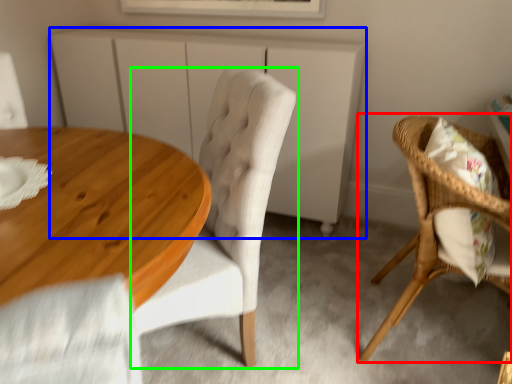
Question: Which object is positioned closest to chair (highlighted by a red box)? Select from cabinetry (highlighted by a blue box) and chair (highlighted by a green box).

Choices:
 (A) cabinetry
 (B) chair

Answer: (B)